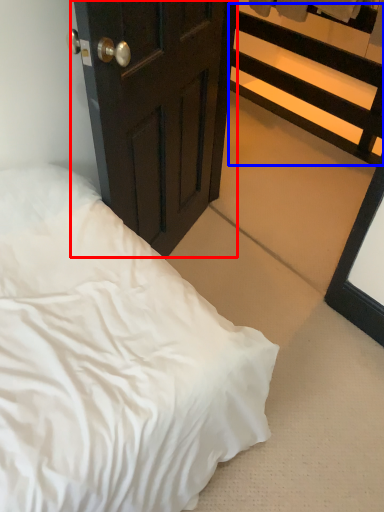
Question: Among these objects, which one is farthest to the camera, door (highlighted by a red box) or balustrade (highlighted by a blue box)?

Choices:
 (A) door
 (B) balustrade

Answer: (B)